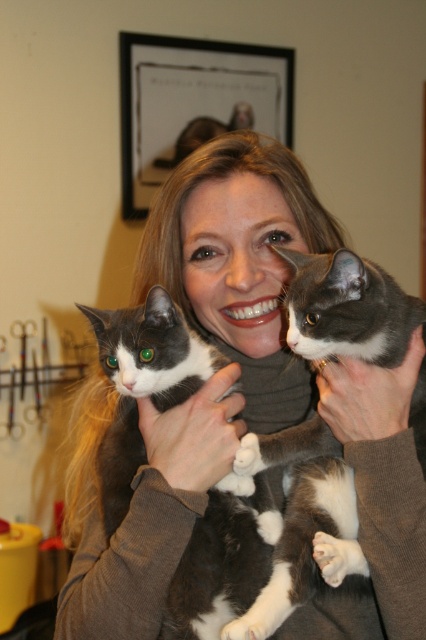
You are a photographer trying to capture a closeup shot of the soft gray sweater at center and the soft gray fur at upper right. Which object is wider in the image?

The soft gray sweater at center is wider than the soft gray fur at upper right.

You are a photographer preparing to take a photo of the woman holding the cats. You need to ensure that both the matte gray sweater at center and the soft gray fur at upper right are clearly visible in the frame. Which object should you focus on first to ensure proper exposure, considering their sizes?

The matte gray sweater at center should be focused on first because it has a larger size compared to the soft gray fur at upper right, making it more prominent in the frame.

The woman in the scene is wearing two sweaters. Based on the description, which sweater is positioned higher on her body, the matte gray sweater at center or the soft gray sweater at center?

The matte gray sweater at center is taller than the soft gray sweater at center, so the matte gray sweater at center is positioned higher on her body.